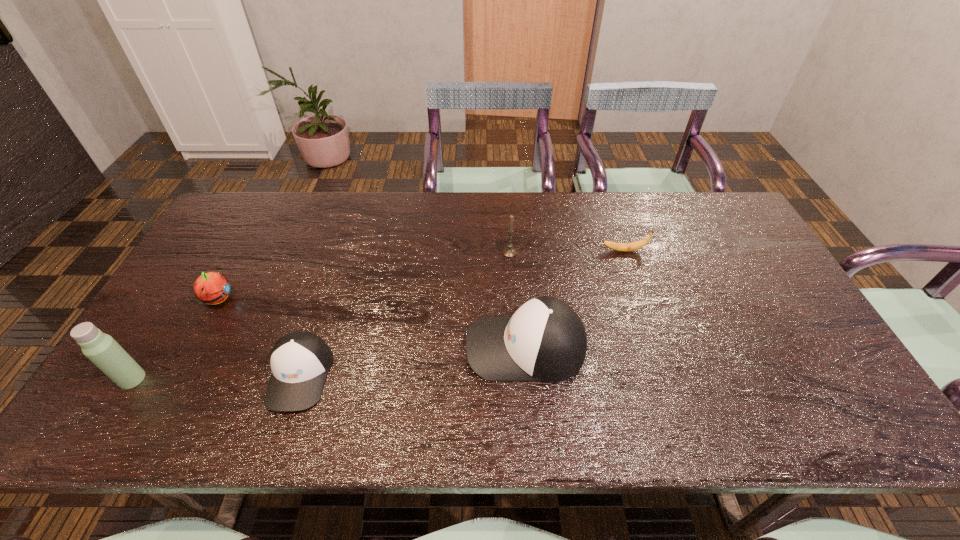
At what (x,y) coordinates should I click in order to perform the action: click on free spot located on the front panel of the right cap. Please return your answer as a coordinate pair (x, y). The width and height of the screenshot is (960, 540). Looking at the image, I should click on (422, 347).

Identify the location of vacant region located on the front panel of the right cap. (371, 347).

This screenshot has width=960, height=540. Identify the location of vacant space situated on the front panel of the right cap. (422, 347).

Locate an element on the screen. The height and width of the screenshot is (540, 960). free space located on the left of the apple is located at coordinates (177, 299).

Image resolution: width=960 pixels, height=540 pixels. Find the location of `free location located on the front of the candle`. free location located on the front of the candle is located at coordinates (516, 354).

Locate an element on the screen. The image size is (960, 540). vacant space located on the peel of the banana from the top is located at coordinates (522, 251).

Image resolution: width=960 pixels, height=540 pixels. I want to click on free space located on the peel of the banana from the top, so click(541, 251).

Where is `free space located 0.110m on the peel of the banana from the top`? Image resolution: width=960 pixels, height=540 pixels. free space located 0.110m on the peel of the banana from the top is located at coordinates (564, 251).

Locate an element on the screen. vacant region located on the back of the leftmost object is located at coordinates (199, 272).

This screenshot has width=960, height=540. Identify the location of thermos bottle at the near edge. (100, 348).